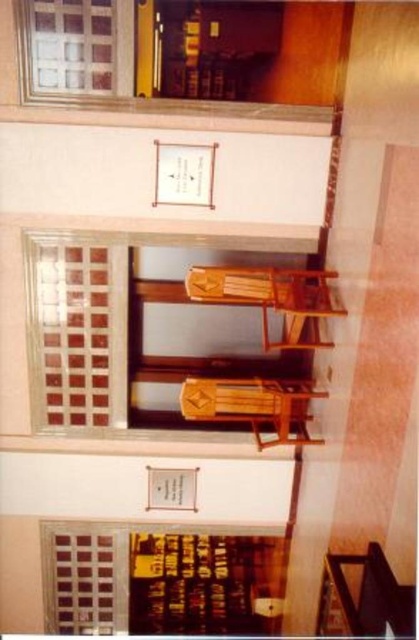
This screenshot has width=419, height=640. What do you see at coordinates (154, 573) in the screenshot?
I see `matte glass window at lower left` at bounding box center [154, 573].

At what (x,y) coordinates should I click in order to perform the action: click on matte glass window at lower left. Please return your answer as a coordinate pair (x, y). Looking at the image, I should click on (154, 573).

The height and width of the screenshot is (640, 419). Find the location of `matte glass window at lower left`. matte glass window at lower left is located at coordinates (154, 573).